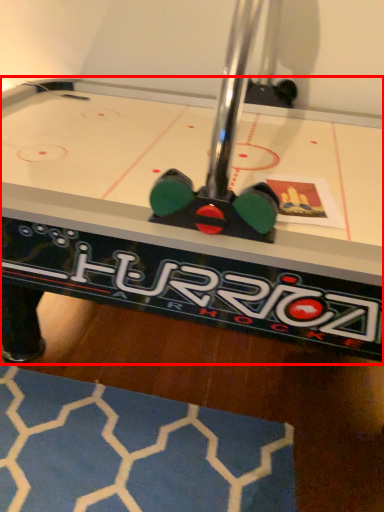
Question: Where is table (annotated by the red box) located in relation to mat in the image?

Choices:
 (A) right
 (B) left

Answer: (A)